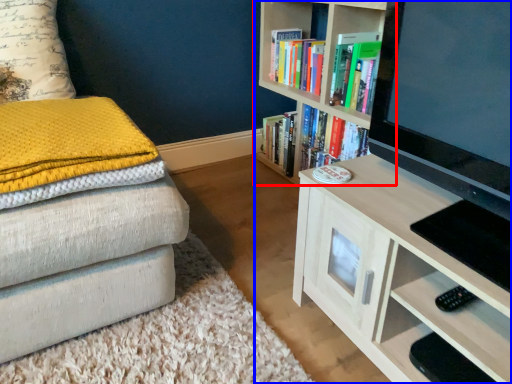
Question: Among these objects, which one is nearest to the camera, bookcase (highlighted by a red box) or bookcase (highlighted by a blue box)?

Choices:
 (A) bookcase
 (B) bookcase

Answer: (B)